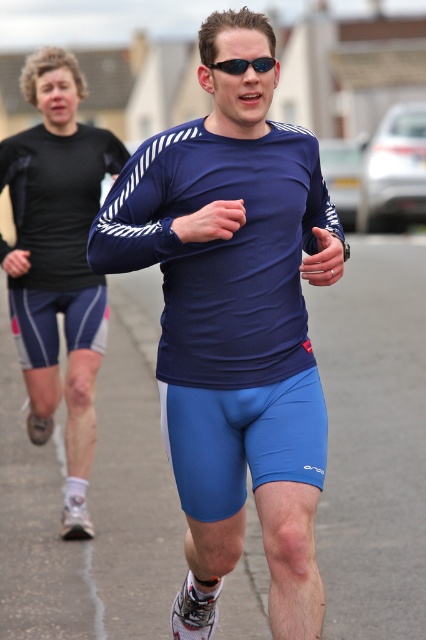
You are a photographer trying to capture a runner in an urban setting. You notice the matte blue running suit at center and the sunglasses at center. Which object is located to the left of the other?

The matte blue running suit at center is positioned on the left side of sunglasses at center.

You are a runner who wants to catch up with the other runner ahead of you. You are currently at point (60, 76). The distance between you and the other runner is 7.07 meters. If you can run at a speed of 8 m per second and the other runner is running at 6 m per second, how many seconds will it take for you to catch them?

The distance between you and the other runner is 7.07 meters. Your speed is 8 m per second, and the other runner is running at 6 m per second. The relative speed between you is 8 m per second minus 6 m per second equals 2 m per second. To catch up, you need to cover the 7.07 meters at a relative speed of 2 m per second. The time required is 7.07 divided by 2, which equals approximately 3.535 seconds. Therefore, it will take about 3.54 seconds to catch the other runner.

In the scene shown: You are a photographer standing at the origin point of the image coordinate system. You want to take a photo of the matte blue running suit at center. What are the coordinates where you should aim your camera?

The coordinates to aim the camera are at point [235,323] where the matte blue running suit at center is located.